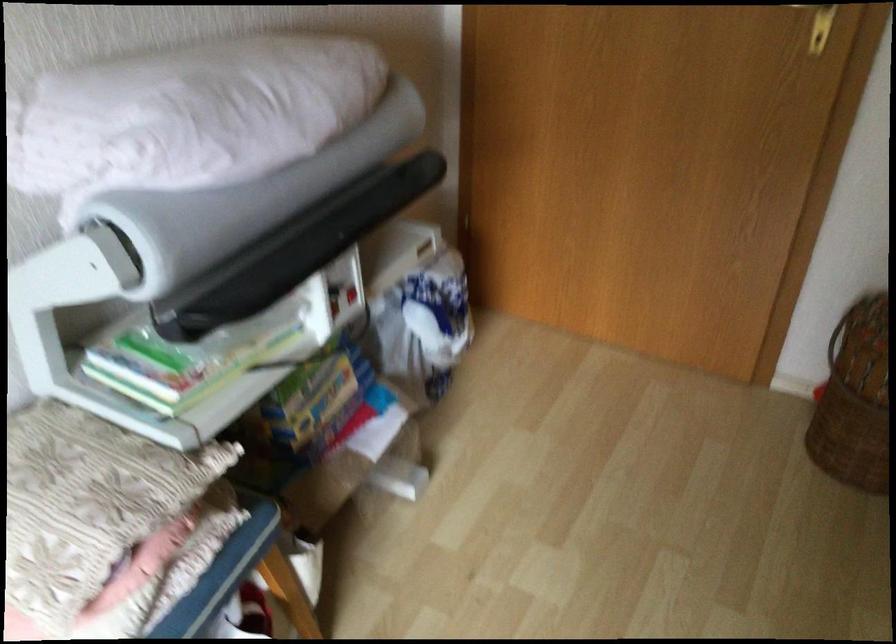
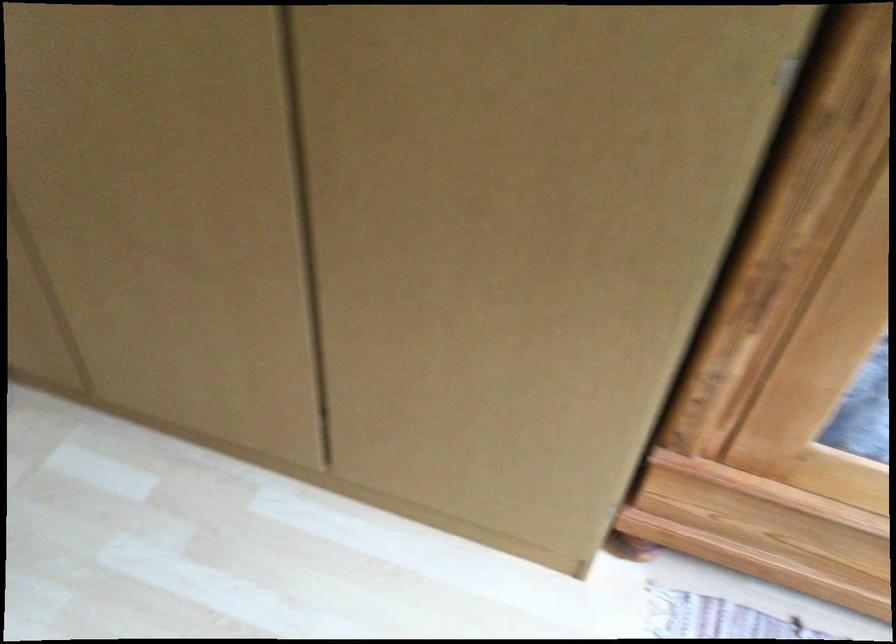
How did the camera likely rotate?

The rotation direction of the camera is right-down.